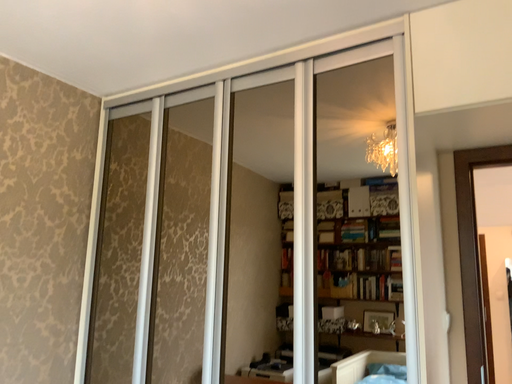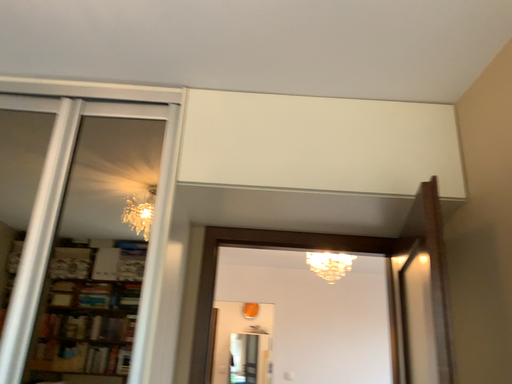
Question: How did the camera likely rotate when shooting the video?

Choices:
 (A) rotated left
 (B) rotated right

Answer: (B)